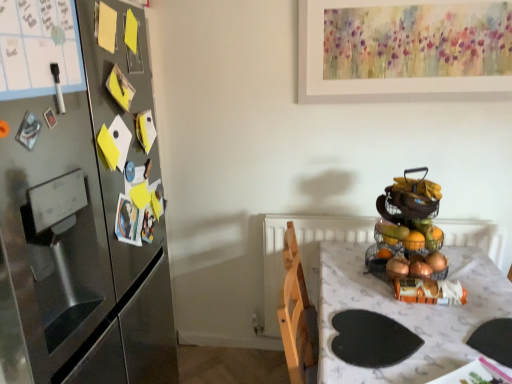
I want to click on free space above white glossy table at center (from a real-world perspective), so click(x=408, y=301).